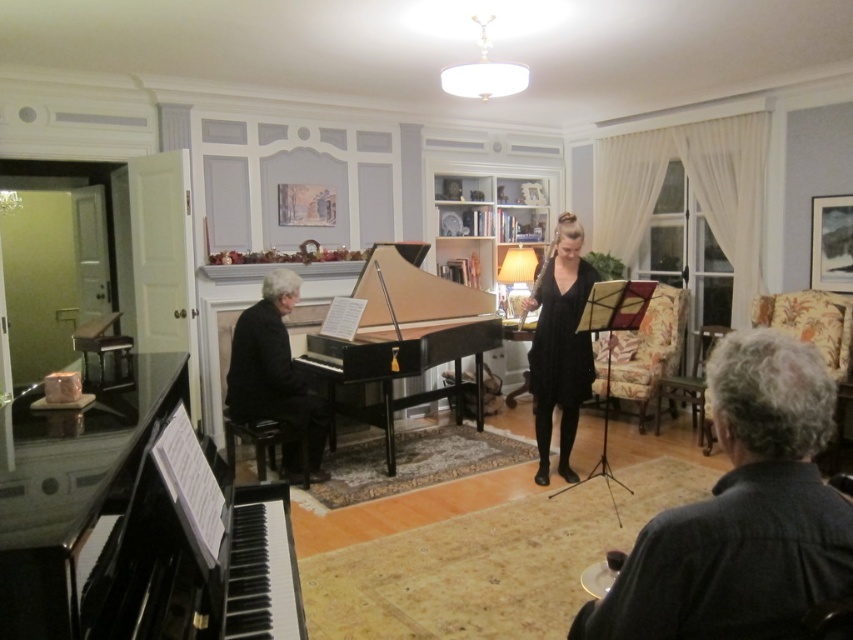
Question: Which point is closer to the camera?

Choices:
 (A) (773, 481)
 (B) (276, 300)

Answer: (A)

Question: Can you confirm if black polished piano at left is thinner than black satin dress at center?

Choices:
 (A) no
 (B) yes

Answer: (A)

Question: Among these points, which one is farthest from the camera?

Choices:
 (A) (704, 509)
 (B) (323, 404)

Answer: (B)

Question: Is dark gray fabric jacket at lower right positioned behind black satin dress at center?

Choices:
 (A) no
 (B) yes

Answer: (A)

Question: From the image, what is the correct spatial relationship of dark gray fabric jacket at lower right in relation to black glossy piano at center?

Choices:
 (A) left
 (B) right

Answer: (B)

Question: Estimate the real-world distances between objects in this image. Which object is farther from the black glossy piano at center?

Choices:
 (A) dark gray fabric jacket at lower right
 (B) black satin dress at center
 (C) black polished wood grand piano at center

Answer: (A)